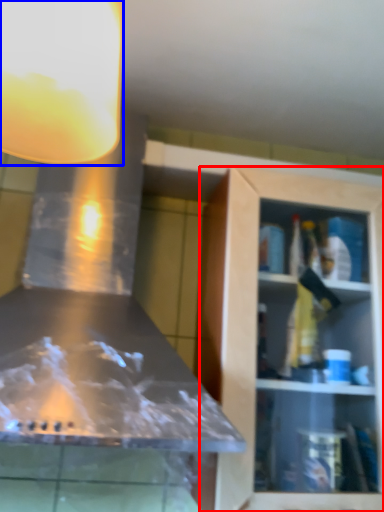
Question: Which point is further to the camera, cabinetry (highlighted by a red box) or light fixture (highlighted by a blue box)?

Choices:
 (A) cabinetry
 (B) light fixture

Answer: (A)